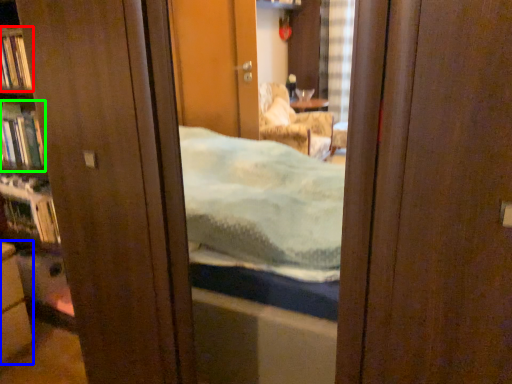
Question: Which object is positioned closest to book (highlighted by a red box)? Select from cabinetry (highlighted by a blue box) and book (highlighted by a green box).

Choices:
 (A) cabinetry
 (B) book

Answer: (B)